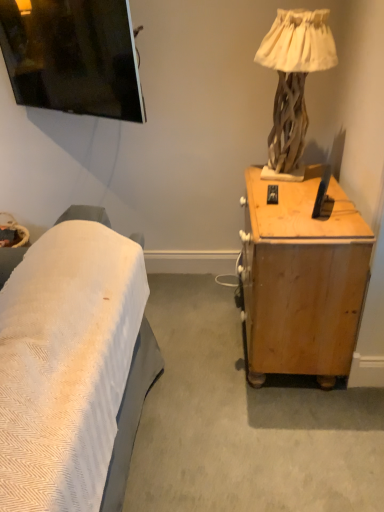
The width and height of the screenshot is (384, 512). Describe the element at coordinates (294, 77) in the screenshot. I see `wooden textured lamp at upper right` at that location.

Find the location of a particular element. Image resolution: width=384 pixels, height=512 pixels. wooden textured lamp at upper right is located at coordinates 294,77.

Measure the distance between wooden desk at right and camera.

wooden desk at right is 1.48 meters from camera.

What do you see at coordinates (302, 279) in the screenshot? The height and width of the screenshot is (512, 384). I see `wooden desk at right` at bounding box center [302, 279].

Find the location of a particular element. This screenshot has width=384, height=512. wooden desk at right is located at coordinates (302, 279).

The width and height of the screenshot is (384, 512). In order to click on wooden textured lamp at upper right in this screenshot , I will do `click(294, 77)`.

Does wooden desk at right appear on the left side of wooden textured lamp at upper right?

No.

Is wooden desk at right positioned in front of wooden textured lamp at upper right?

Yes, it is in front of wooden textured lamp at upper right.

Which point is more distant from viewer, (x=268, y=259) or (x=300, y=90)?

Positioned behind is point (x=300, y=90).

From the image's perspective, is wooden desk at right above wooden textured lamp at upper right?

No, from the image's perspective, wooden desk at right is not over wooden textured lamp at upper right.

From a real-world perspective, is wooden desk at right located beneath wooden textured lamp at upper right?

Yes, from a real-world perspective, wooden desk at right is below wooden textured lamp at upper right.

Which object is wider, wooden desk at right or wooden textured lamp at upper right?

Wider between the two is wooden desk at right.

Is wooden desk at right shorter than wooden textured lamp at upper right?

No, wooden desk at right is not shorter than wooden textured lamp at upper right.

Which of these two, wooden desk at right or wooden textured lamp at upper right, is bigger?

With larger size is wooden desk at right.

Which is correct: wooden desk at right is inside wooden textured lamp at upper right, or outside of it?

wooden desk at right is not inside wooden textured lamp at upper right, it's outside.

Are wooden desk at right and wooden textured lamp at upper right making contact?

No, wooden desk at right is not with wooden textured lamp at upper right.

Is wooden desk at right looking in the opposite direction of wooden textured lamp at upper right?

No.

You are a GUI agent. You are given a task and a screenshot of the screen. Output one action in this format:
    pyautogui.click(x=<x>, y=<y>)
    Task: Click on the desk in front of the wooden textured lamp at upper right
    The width and height of the screenshot is (384, 512).
    Given the screenshot: What is the action you would take?
    pyautogui.click(x=302, y=279)

Which is more to the right, wooden textured lamp at upper right or wooden desk at right?

From the viewer's perspective, wooden desk at right appears more on the right side.

Which is behind, wooden textured lamp at upper right or wooden desk at right?

wooden textured lamp at upper right is further from the camera.

Is point (259, 62) positioned before point (306, 232)?

No, (259, 62) is behind (306, 232).

From the image's perspective, is wooden textured lamp at upper right located beneath wooden desk at right?

Incorrect, from the image's perspective, wooden textured lamp at upper right is higher than wooden desk at right.

From the picture: From a real-world perspective, which object rests below the other?

wooden desk at right is physically lower.

Which object is thinner, wooden textured lamp at upper right or wooden desk at right?

wooden textured lamp at upper right is thinner.

Considering the relative sizes of wooden textured lamp at upper right and wooden desk at right in the image provided, is wooden textured lamp at upper right shorter than wooden desk at right?

Yes, wooden textured lamp at upper right is shorter than wooden desk at right.

Which of these two, wooden textured lamp at upper right or wooden desk at right, is bigger?

With larger size is wooden desk at right.

Is wooden textured lamp at upper right positioned beyond the bounds of wooden desk at right?

That's correct, wooden textured lamp at upper right is outside of wooden desk at right.

Can you see wooden textured lamp at upper right touching wooden desk at right?

No, wooden textured lamp at upper right is not touching wooden desk at right.

Is wooden textured lamp at upper right turned away from wooden desk at right?

No, wooden textured lamp at upper right's orientation is not away from wooden desk at right.

Can you tell me how much wooden textured lamp at upper right and wooden desk at right differ in facing direction?

2.93 degrees separate the facing orientations of wooden textured lamp at upper right and wooden desk at right.

Image resolution: width=384 pixels, height=512 pixels. What are the coordinates of `lamp on the left of wooden desk at right` in the screenshot? It's located at (294, 77).

Find the location of a particular element. Image resolution: width=384 pixels, height=512 pixels. desk that is below the wooden textured lamp at upper right (from the image's perspective) is located at coordinates (302, 279).

This screenshot has width=384, height=512. Find the location of `lamp behind the wooden desk at right`. lamp behind the wooden desk at right is located at coordinates (294, 77).